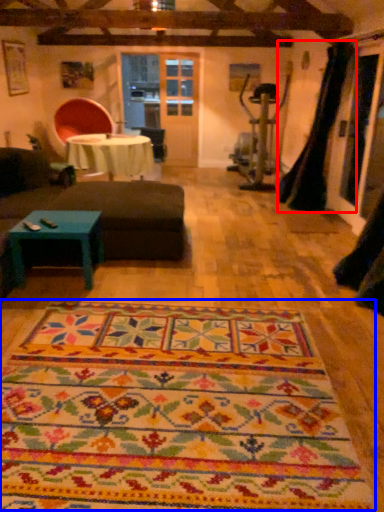
Question: Which object is further to the camera taking this photo, curtain (highlighted by a red box) or mat (highlighted by a blue box)?

Choices:
 (A) curtain
 (B) mat

Answer: (A)